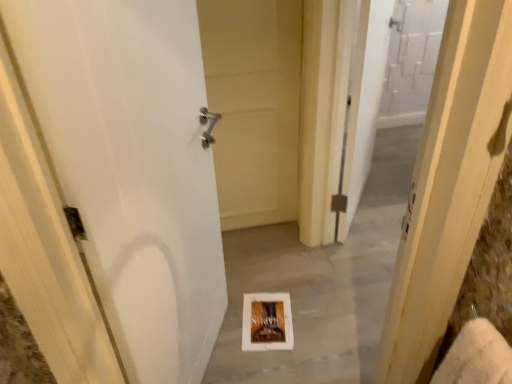
Where is `vacant space to the right of white cardboard book at center`? This screenshot has height=384, width=512. vacant space to the right of white cardboard book at center is located at coordinates (315, 312).